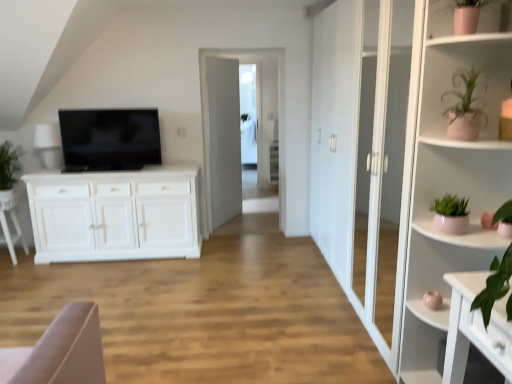
You are a GUI agent. You are given a task and a screenshot of the screen. Output one action in this format:
    pyautogui.click(x=<x>, y=<y>)
    Task: Click on the vacant space to the right of transparent glass door at center
    
    Given the screenshot: What is the action you would take?
    pyautogui.click(x=273, y=235)